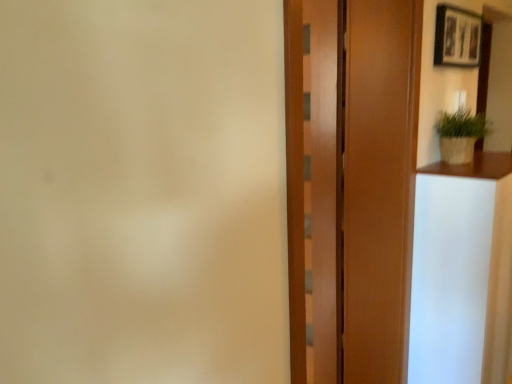
Question: Is wooden door at center oriented away from wooden picture frame at upper right?

Choices:
 (A) yes
 (B) no

Answer: (B)

Question: Is wooden door at center surrounding wooden picture frame at upper right?

Choices:
 (A) no
 (B) yes

Answer: (A)

Question: Is wooden door at center not within wooden picture frame at upper right?

Choices:
 (A) no
 (B) yes

Answer: (B)

Question: Is wooden door at center closer to camera compared to wooden picture frame at upper right?

Choices:
 (A) yes
 (B) no

Answer: (A)

Question: Is wooden door at center further to the viewer compared to wooden picture frame at upper right?

Choices:
 (A) yes
 (B) no

Answer: (B)

Question: From a real-world perspective, relative to wooden picture frame at upper right, is wooden barn door at center vertically above or below?

Choices:
 (A) below
 (B) above

Answer: (A)

Question: Is wooden barn door at center taller or shorter than wooden picture frame at upper right?

Choices:
 (A) short
 (B) tall

Answer: (B)

Question: Considering the positions of wooden barn door at center and wooden picture frame at upper right in the image, is wooden barn door at center wider or thinner than wooden picture frame at upper right?

Choices:
 (A) wide
 (B) thin

Answer: (B)

Question: From the image's perspective, relative to wooden picture frame at upper right, is wooden barn door at center above or below?

Choices:
 (A) above
 (B) below

Answer: (B)

Question: In terms of height, does wooden door at center look taller or shorter compared to wooden barn door at center?

Choices:
 (A) short
 (B) tall

Answer: (B)

Question: Is wooden door at center in front of or behind wooden barn door at center in the image?

Choices:
 (A) behind
 (B) front

Answer: (B)

Question: Would you say wooden door at center is inside or outside wooden barn door at center?

Choices:
 (A) inside
 (B) outside

Answer: (B)

Question: Based on their positions, is wooden door at center located to the left or right of wooden barn door at center?

Choices:
 (A) left
 (B) right

Answer: (A)

Question: Is white glossy vanity at right in front of or behind wooden barn door at center in the image?

Choices:
 (A) behind
 (B) front

Answer: (A)

Question: Is white glossy vanity at right bigger or smaller than wooden barn door at center?

Choices:
 (A) big
 (B) small

Answer: (A)